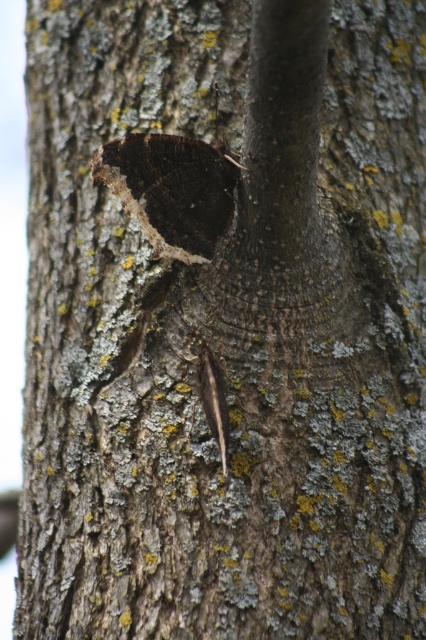
Can you confirm if dark matte butterfly at center is positioned to the right of brown fuzzy caterpillar at center?

In fact, dark matte butterfly at center is to the left of brown fuzzy caterpillar at center.

Between point (207, 237) and point (216, 397), which one is positioned in front?

Point (216, 397)

Find the location of a particular element. The width and height of the screenshot is (426, 640). dark matte butterfly at center is located at coordinates (172, 189).